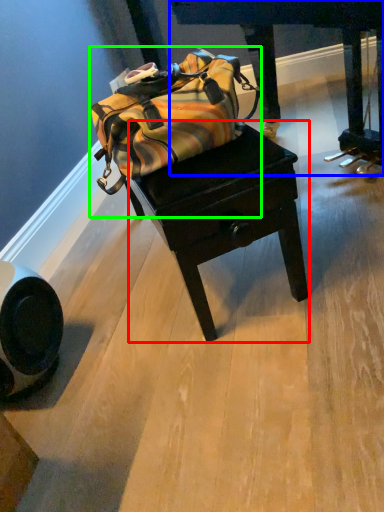
Question: Estimate the real-world distances between objects in this image. Which object is farther from table (highlighted by a red box), furniture (highlighted by a blue box) or luggage and bags (highlighted by a green box)?

Choices:
 (A) furniture
 (B) luggage and bags

Answer: (A)